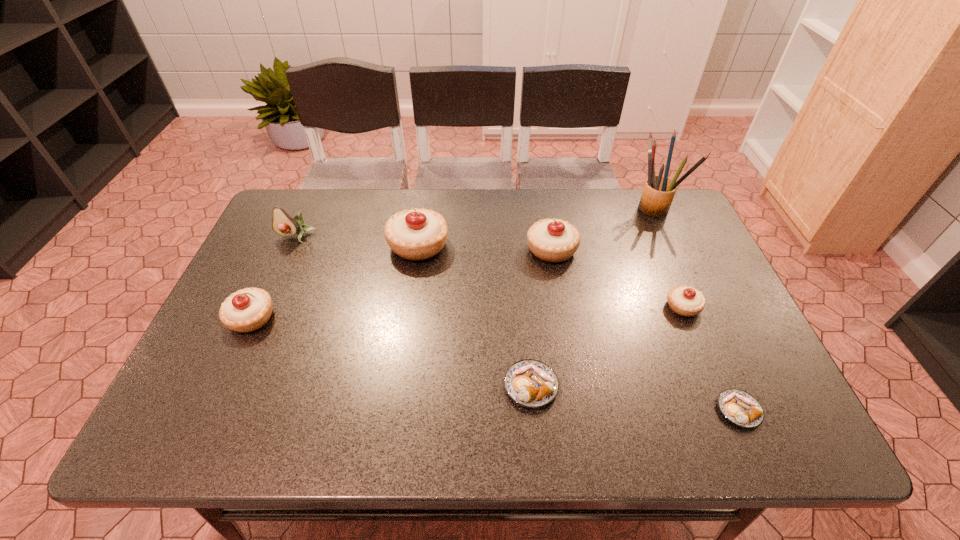
You are a GUI agent. You are given a task and a screenshot of the screen. Output one action in this format:
    pyautogui.click(x=<x>, y=<y>)
    Task: Click on the rightmost beige pastry
    Image resolution: width=960 pixels, height=540 pixels.
    Given the screenshot: What is the action you would take?
    pyautogui.click(x=687, y=301)

The height and width of the screenshot is (540, 960). What are the coordinates of `the fifth tallest pastry` in the screenshot? It's located at (530, 383).

Identify the location of the left brown pastry. (530, 383).

What are the coordinates of `the smaller brown pastry` in the screenshot? It's located at (739, 407).

You are a GUI agent. You are given a task and a screenshot of the screen. Output one action in this format:
    pyautogui.click(x=<x>, y=<y>)
    Task: Click on the shortest object
    
    Given the screenshot: What is the action you would take?
    pyautogui.click(x=739, y=407)

At what (x,y) coordinates should I click in order to perform the action: click on blank space located on the front of the pencil box. Please return your answer as a coordinate pair (x, y). Looking at the image, I should click on (706, 317).

The height and width of the screenshot is (540, 960). What are the coordinates of `vacant space located on the front of the tallest pastry` in the screenshot? It's located at (411, 299).

The image size is (960, 540). Find the location of `vacant space located 0.080m on the seed side of the avocado`. vacant space located 0.080m on the seed side of the avocado is located at coordinates (285, 262).

At what (x,y) coordinates should I click in order to perform the action: click on free spot located 0.220m on the left of the second beige pastry from right to left. Please return your answer as a coordinate pair (x, y). This screenshot has height=540, width=960. Looking at the image, I should click on coord(450,249).

Locate an element on the screen. Image resolution: width=960 pixels, height=540 pixels. free location located 0.090m on the front of the leftmost pastry is located at coordinates (228, 369).